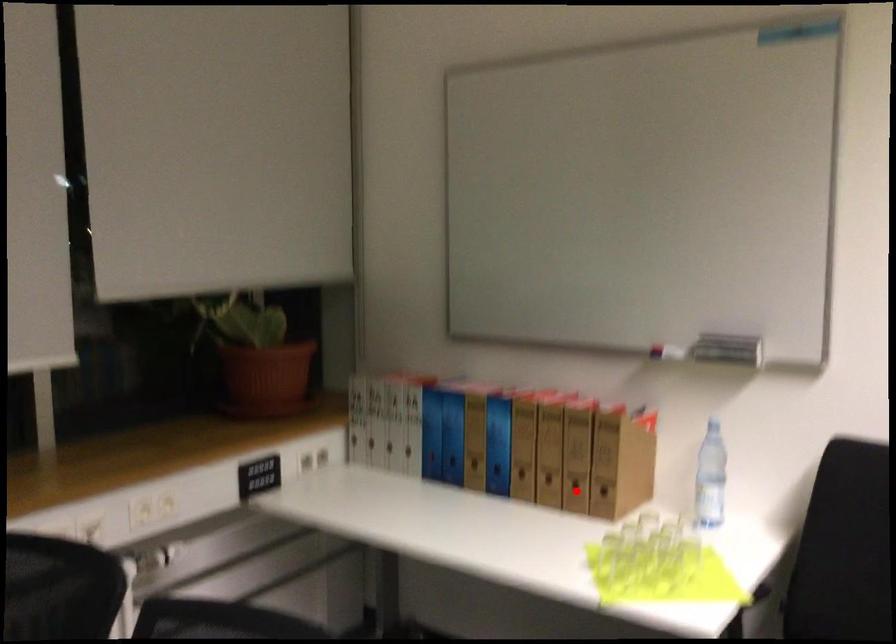
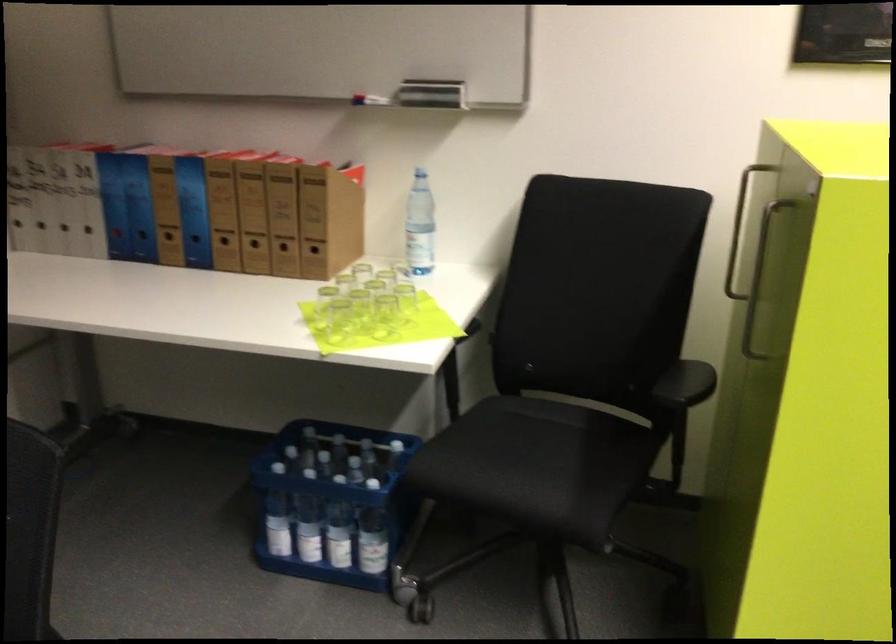
In the second image, find the point that corresponds to the highlighted location in the first image.

(283, 252)